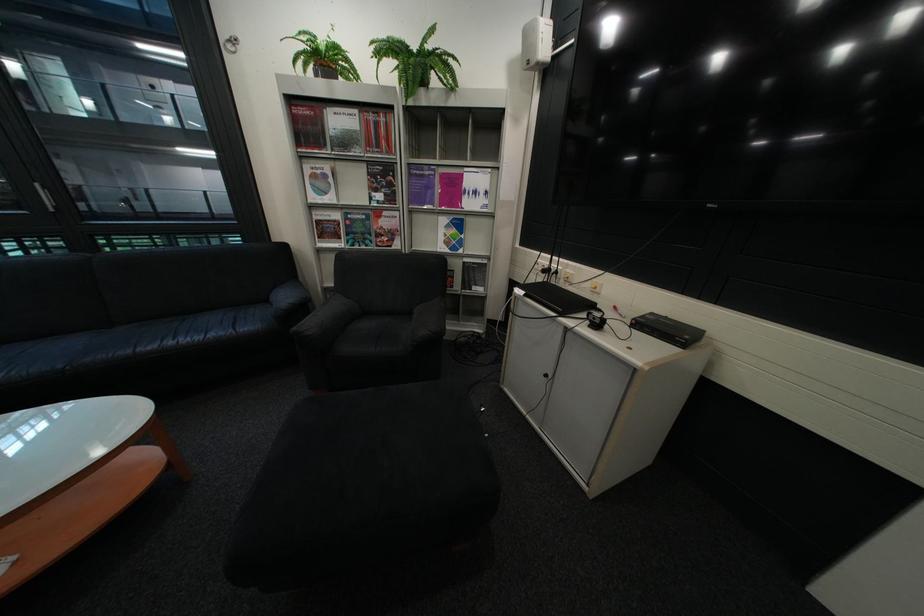
At what (x,y) coordinates should I click in order to perform the action: click on black laptop computer. Please return your answer as a coordinate pair (x, y). Looking at the image, I should click on (556, 298).